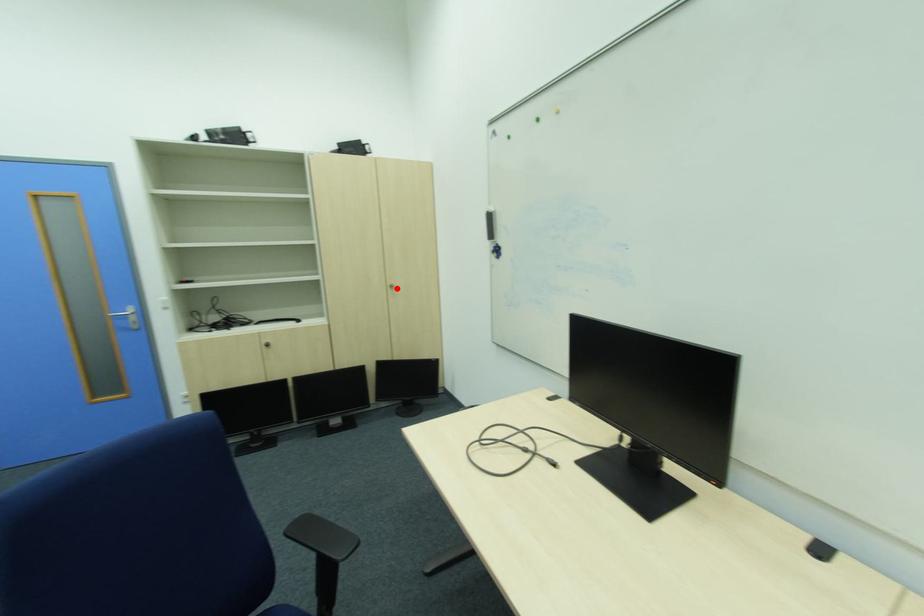
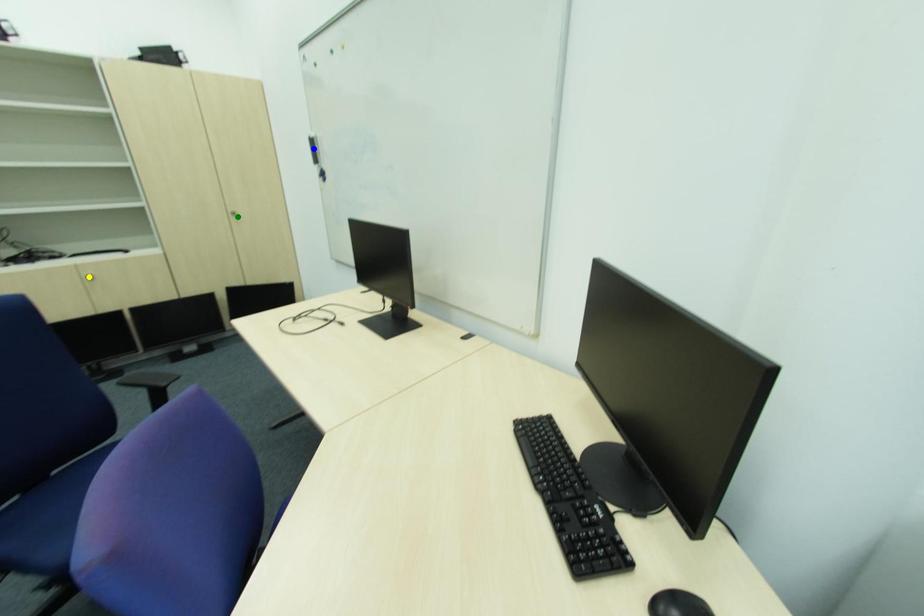
Question: I am providing you with two images of the same scene from different viewpoints. A red point is marked on the first image. You are given multiple points on the second image. Which point in image 2 is actually the same real-world point as the red point in image 1?

Choices:
 (A) green point
 (B) yellow point
 (C) blue point

Answer: (A)